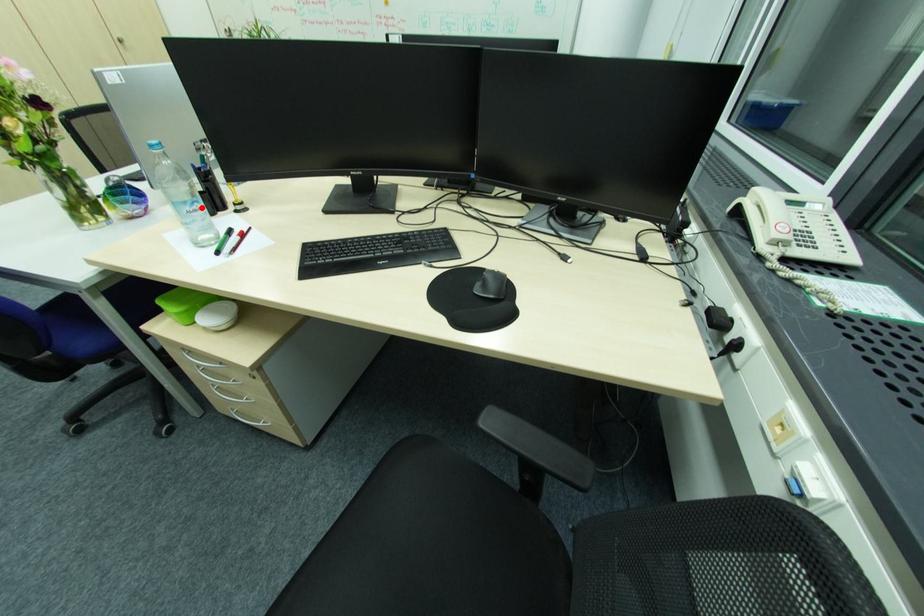
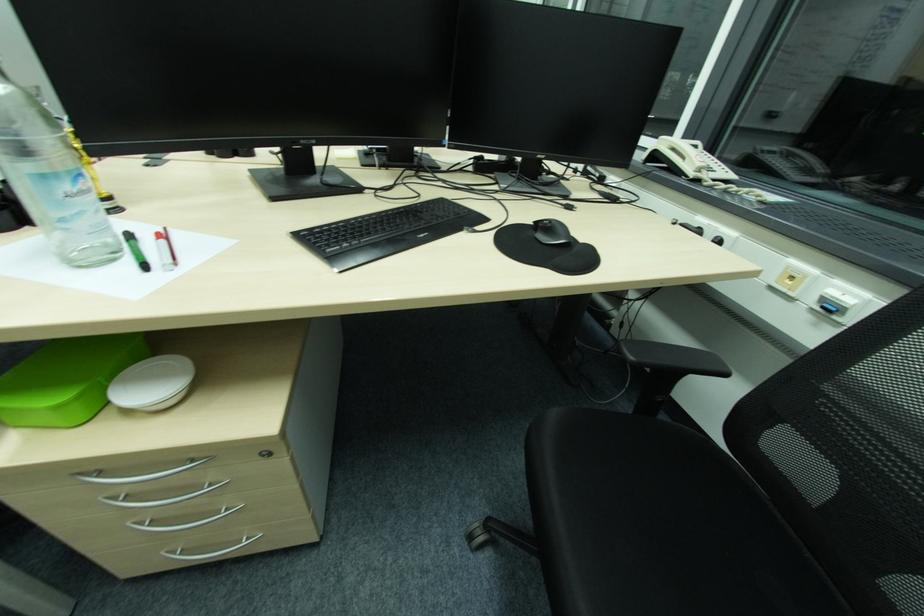
In the second image, find the point that corresponds to the highlighted location in the first image.

(83, 185)